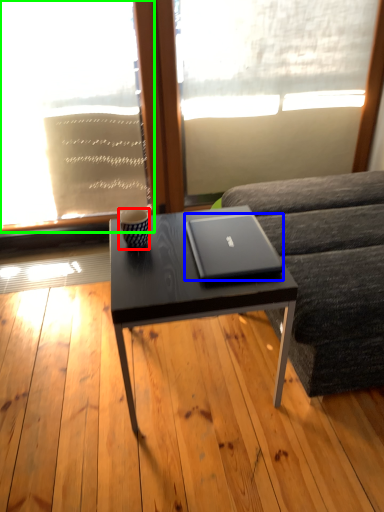
Question: Considering the real-world distances, which object is closest to coffee cup (highlighted by a red box)? laptop (highlighted by a blue box) or window screen (highlighted by a green box).

Choices:
 (A) laptop
 (B) window screen

Answer: (A)